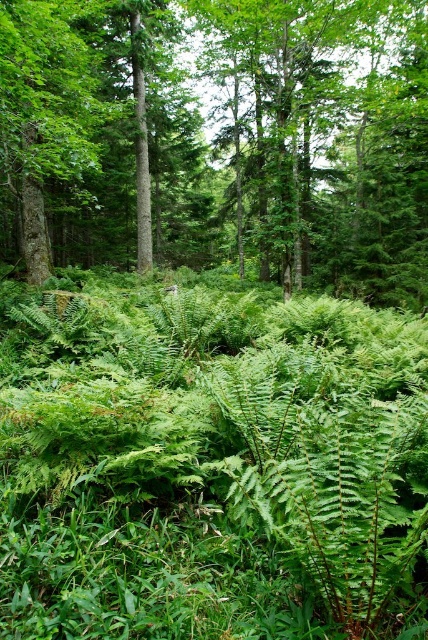
Does green leafy grass at center have a larger size compared to green leafy tree at center?

Incorrect, green leafy grass at center is not larger than green leafy tree at center.

Which of these two, green leafy grass at center or green leafy tree at center, stands taller?

green leafy tree at center

Which is behind, point (125, 378) or point (86, 115)?

The point (86, 115) is more distant.

Locate an element on the screen. The height and width of the screenshot is (640, 428). green leafy grass at center is located at coordinates (211, 467).